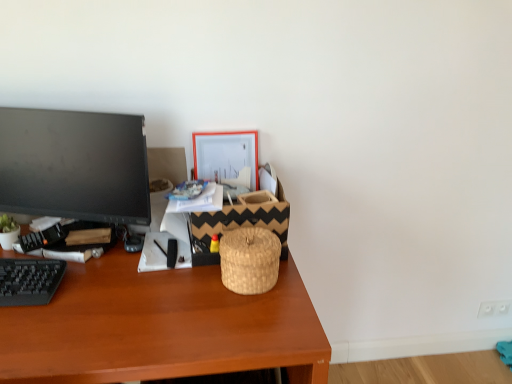
Question: Is woven straw basket at center, which is the second basket in front-to-back order, thinner than woven natural basket at center, the second basket from the back?

Choices:
 (A) no
 (B) yes

Answer: (A)

Question: Considering the relative positions of woven straw basket at center, which is the second basket in front-to-back order, and woven natural basket at center, the first basket in the front-to-back sequence, in the image provided, is woven straw basket at center, which is the second basket in front-to-back order, to the left of woven natural basket at center, the first basket in the front-to-back sequence, from the viewer's perspective?

Choices:
 (A) no
 (B) yes

Answer: (B)

Question: From a real-world perspective, is woven straw basket at center, which is the second basket in front-to-back order, physically above woven natural basket at center, the first basket in the front-to-back sequence?

Choices:
 (A) yes
 (B) no

Answer: (A)

Question: Can you confirm if woven straw basket at center, marked as the 1th basket in a back-to-front arrangement, is positioned to the right of woven natural basket at center, the first basket in the front-to-back sequence?

Choices:
 (A) no
 (B) yes

Answer: (A)

Question: Is woven straw basket at center, marked as the 1th basket in a back-to-front arrangement, outside of woven natural basket at center, the second basket from the back?

Choices:
 (A) yes
 (B) no

Answer: (A)

Question: Is orange matte picture frame at upper center to the left or to the right of brown wooden desk at center in the image?

Choices:
 (A) right
 (B) left

Answer: (A)

Question: Is point (223, 152) positioned closer to the camera than point (51, 337)?

Choices:
 (A) farther
 (B) closer

Answer: (A)

Question: From a real-world perspective, is orange matte picture frame at upper center above or below brown wooden desk at center?

Choices:
 (A) below
 (B) above

Answer: (B)

Question: In terms of width, does orange matte picture frame at upper center look wider or thinner when compared to brown wooden desk at center?

Choices:
 (A) thin
 (B) wide

Answer: (A)

Question: Would you say black glossy monitor at left is to the left or to the right of orange matte picture frame at upper center in the picture?

Choices:
 (A) left
 (B) right

Answer: (A)

Question: In terms of height, does black glossy monitor at left look taller or shorter compared to orange matte picture frame at upper center?

Choices:
 (A) short
 (B) tall

Answer: (B)

Question: Considering the positions of black glossy monitor at left and orange matte picture frame at upper center in the image, is black glossy monitor at left bigger or smaller than orange matte picture frame at upper center?

Choices:
 (A) big
 (B) small

Answer: (A)

Question: From a real-world perspective, is black glossy monitor at left above or below orange matte picture frame at upper center?

Choices:
 (A) above
 (B) below

Answer: (A)

Question: Considering the positions of brown wooden desk at center and black glossy monitor at left in the image, is brown wooden desk at center taller or shorter than black glossy monitor at left?

Choices:
 (A) tall
 (B) short

Answer: (A)

Question: Considering the positions of point tap(286, 357) and point tap(74, 198), is point tap(286, 357) closer or farther from the camera than point tap(74, 198)?

Choices:
 (A) farther
 (B) closer

Answer: (B)